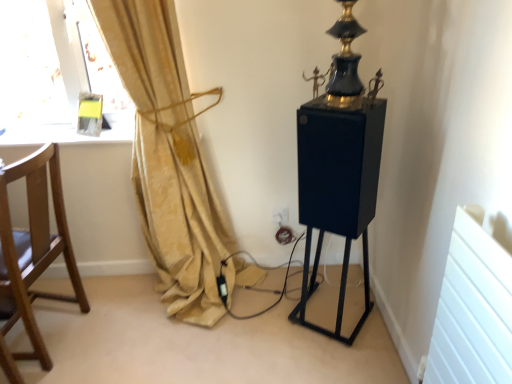
Where is `vacant area that lies between wooden chair at left and gold fabric curtain at left`? vacant area that lies between wooden chair at left and gold fabric curtain at left is located at coordinates (129, 331).